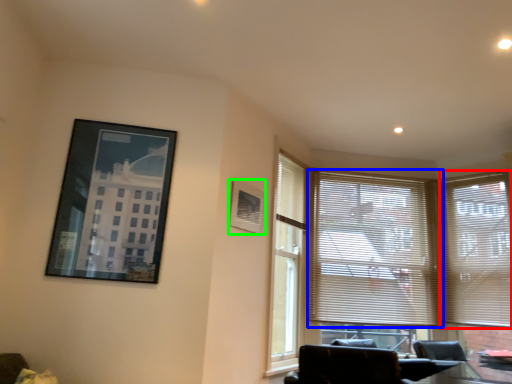
Question: Which is farther away from window blind (highlighted by a red box)? window blind (highlighted by a blue box) or picture frame (highlighted by a green box)?

Choices:
 (A) window blind
 (B) picture frame

Answer: (B)